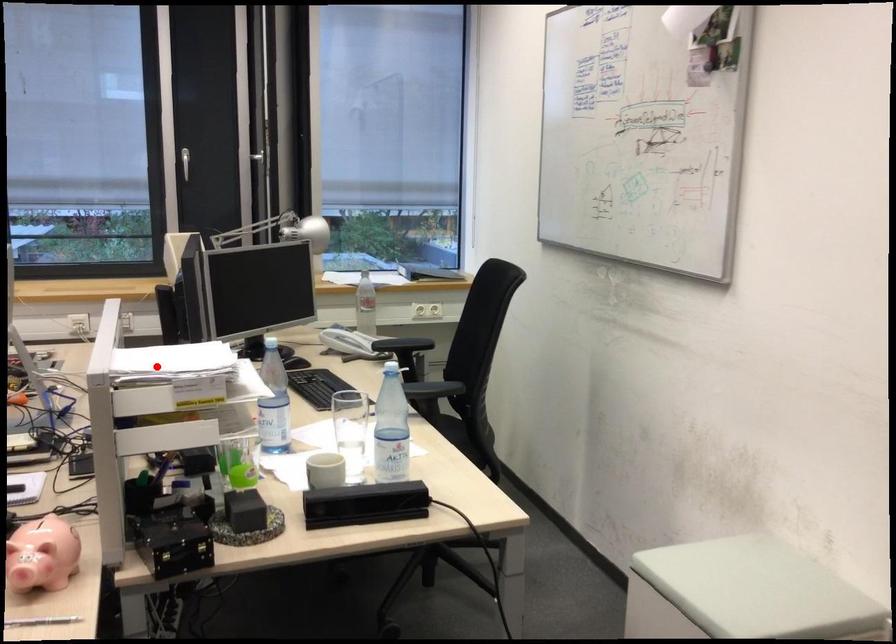
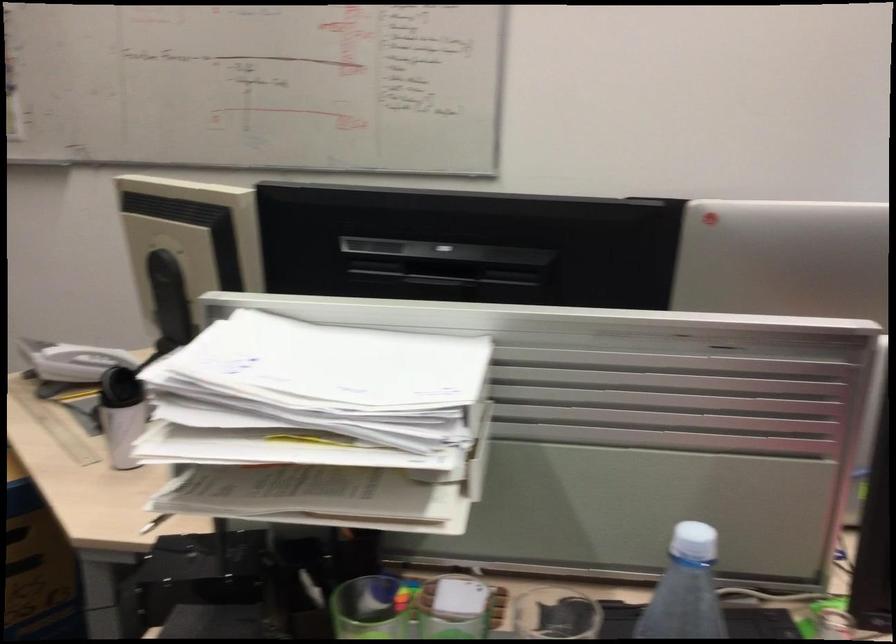
In the second image, find the point that corresponds to the highlighted location in the first image.

(333, 365)